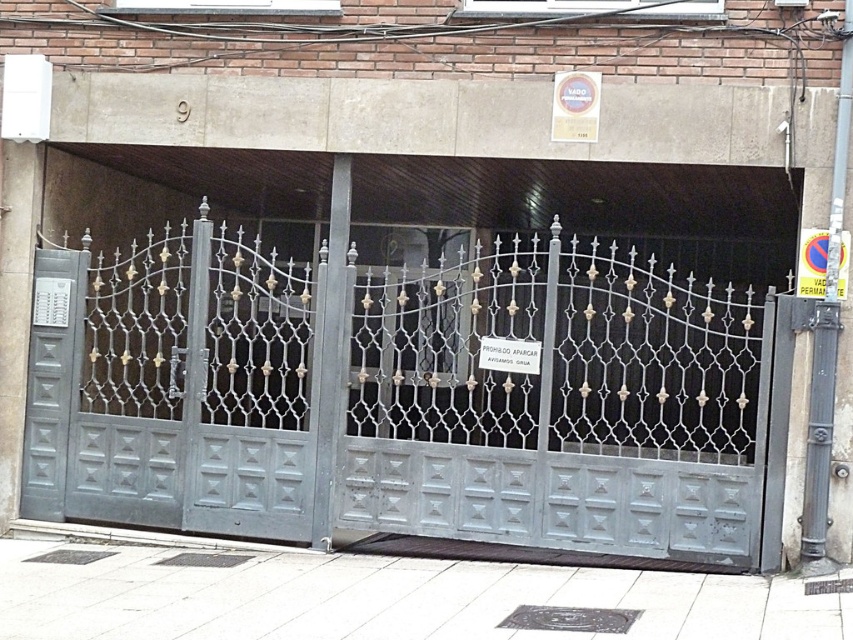
Question: Which of the following is the farthest from the observer?

Choices:
 (A) (39, 264)
 (B) (184, 394)

Answer: (A)

Question: Can you confirm if metallic gate at center is positioned above matte gray door at left?

Choices:
 (A) no
 (B) yes

Answer: (B)

Question: Can you confirm if metallic gate at center is thinner than matte gray door at left?

Choices:
 (A) no
 (B) yes

Answer: (A)

Question: Is metallic gate at center smaller than matte gray door at left?

Choices:
 (A) yes
 (B) no

Answer: (B)